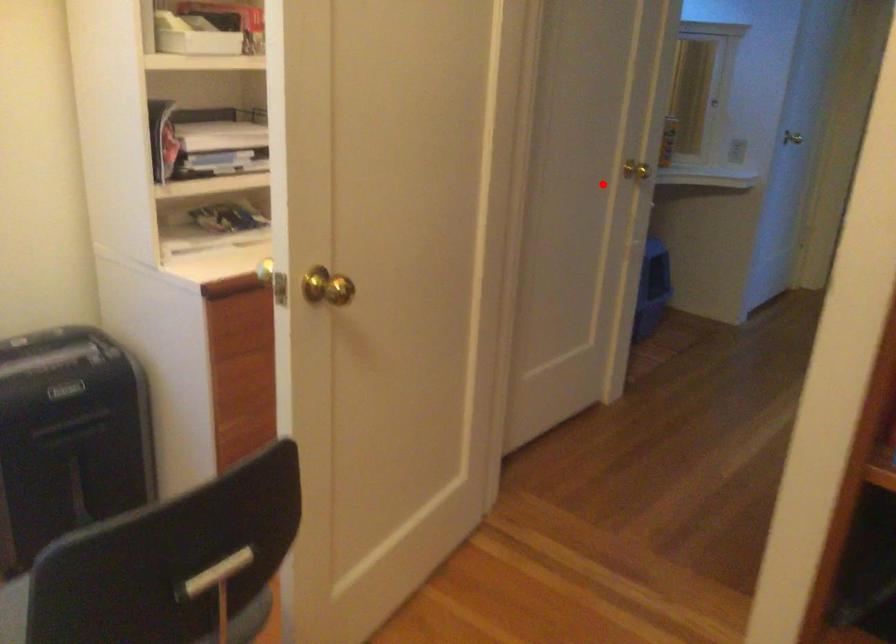
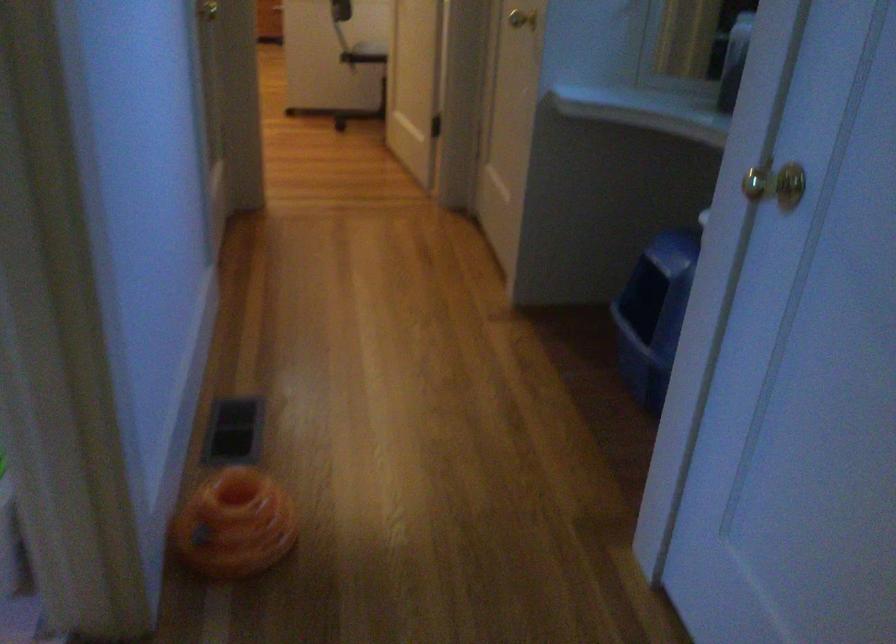
Where in the second image is the point corresponding to the highlighted location from the first image?

(521, 19)